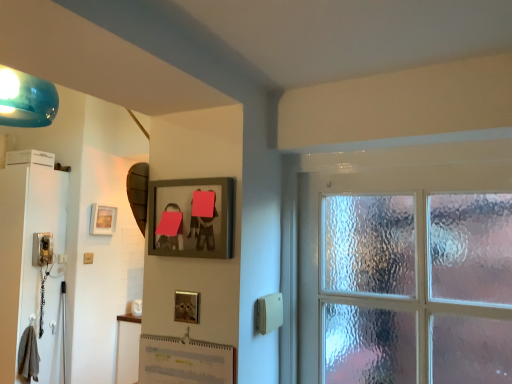
Question: Is point (2, 178) positioned closer to the camera than point (177, 228)?

Choices:
 (A) closer
 (B) farther

Answer: (B)

Question: Is white glossy screen door at left wider or thinner than wooden picture frame at upper center, the second picture frame when ordered from back to front?

Choices:
 (A) thin
 (B) wide

Answer: (B)

Question: Which object is the farthest from the matte white light switch at lower left?

Choices:
 (A) white glossy screen door at left
 (B) wooden picture frame at upper center, marked as the second picture frame in a left-to-right arrangement
 (C) matte black phone at left
 (D) matte gold picture frame at upper left, which appears as the second picture frame when viewed from the right

Answer: (B)

Question: Considering the real-world distances, which object is farthest from the matte white light switch at lower left?

Choices:
 (A) wooden picture frame at upper center, positioned as the first picture frame in right-to-left order
 (B) matte gold picture frame at upper left, positioned as the first picture frame in left-to-right order
 (C) white glossy screen door at left
 (D) matte black phone at left

Answer: (A)